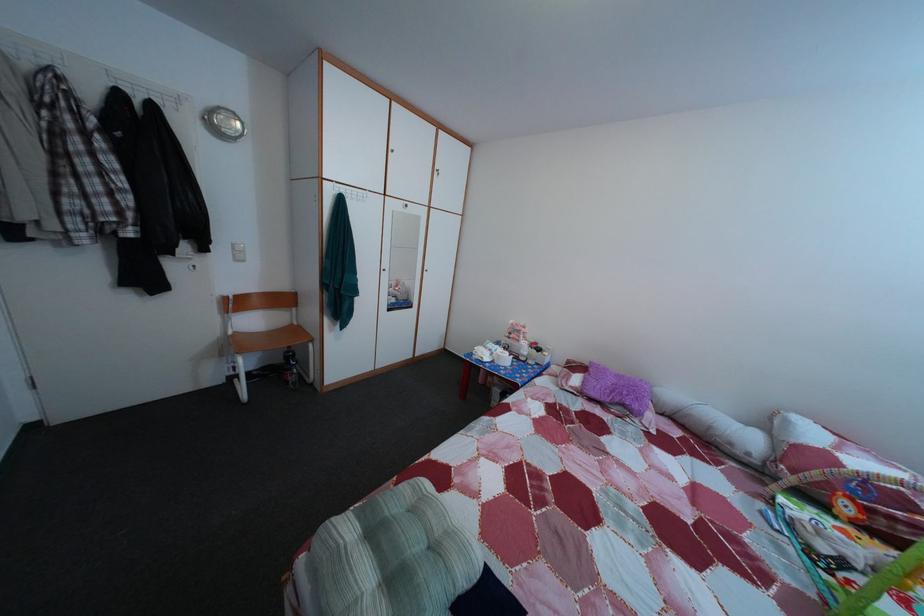
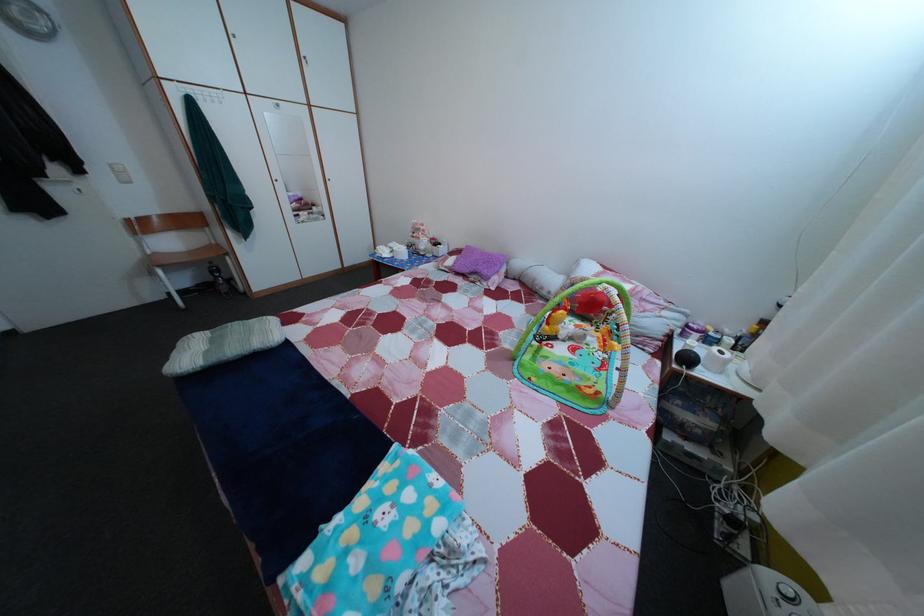
Where in the second image is the point corresponding to (359,522) from the first image?

(217, 339)